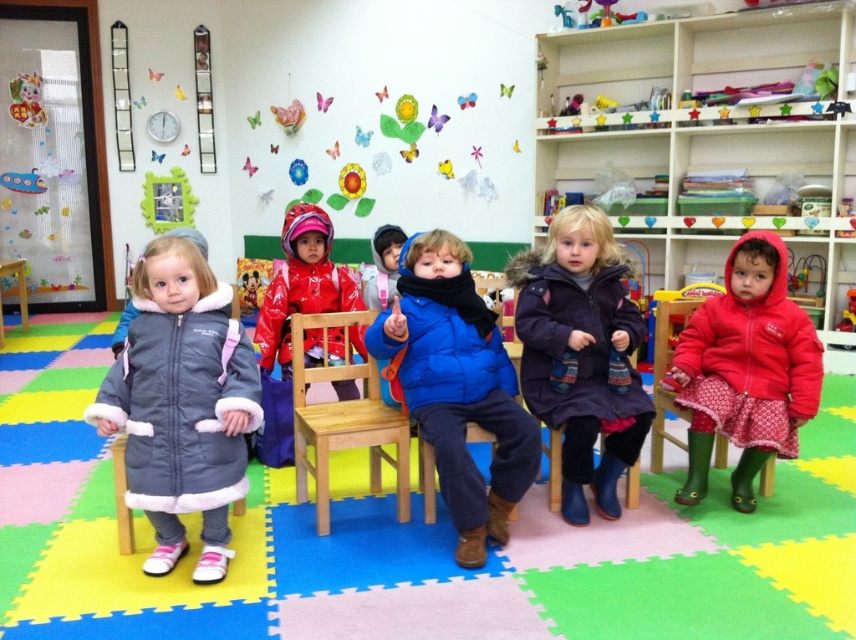
You are standing in the classroom and want to find the blue fuzzy coat at center. According to the coordinates provided, where should you look?

You should look at point (456, 387) to find the blue fuzzy coat at center.

You are a parent standing in the hallway outside the classroom. You want to wave to your child wearing the blue fuzzy coat at center through the classroom window. The window is 2 meters away from you. Can you reach your child by extending your arm through the window?

The blue fuzzy coat at center is 2.56 meters away from the viewer. Since the window is only 2 meters away from you, you cannot reach your child by extending your arm through the window as the distance is greater than your arm length.